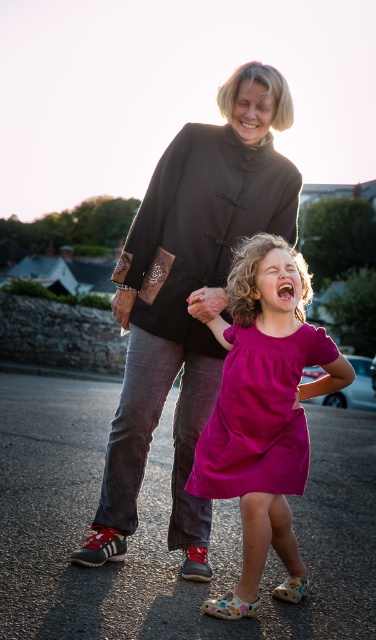
Is black cotton sweater at upper center taller than pink fabric dress at center?

Indeed, black cotton sweater at upper center has a greater height compared to pink fabric dress at center.

Which is more to the left, black cotton sweater at upper center or pink fabric dress at center?

black cotton sweater at upper center is more to the left.

Describe the element at coordinates (186, 296) in the screenshot. The width and height of the screenshot is (376, 640). I see `black cotton sweater at upper center` at that location.

At what (x,y) coordinates should I click in order to perform the action: click on black cotton sweater at upper center. Please return your answer as a coordinate pair (x, y). The width and height of the screenshot is (376, 640). Looking at the image, I should click on (186, 296).